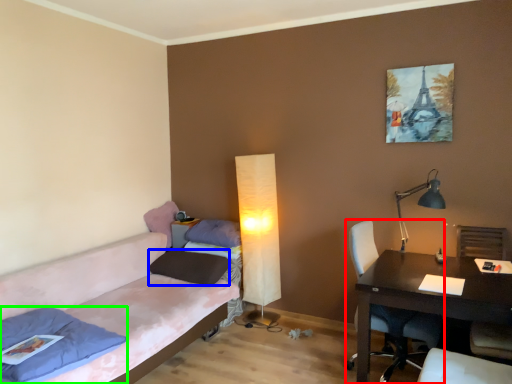
Question: Which is nearer to the chair (highlighted by a red box)? pillow (highlighted by a blue box) or pillow (highlighted by a green box).

Choices:
 (A) pillow
 (B) pillow

Answer: (A)